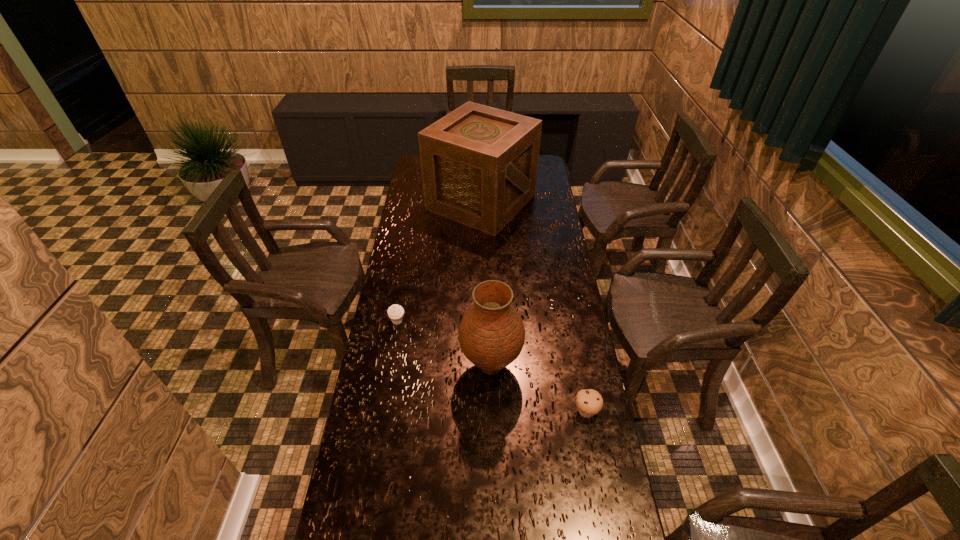
Locate an element on the screen. This screenshot has height=540, width=960. object present at the far edge is located at coordinates (479, 164).

What are the coordinates of `box positioned at the left edge` in the screenshot? It's located at (479, 164).

Where is `muffin that is at the left edge`? This screenshot has height=540, width=960. muffin that is at the left edge is located at coordinates (395, 312).

At what (x,y) coordinates should I click in order to perform the action: click on box at the right edge. Please return your answer as a coordinate pair (x, y). Looking at the image, I should click on (479, 164).

Identify the location of muffin situated at the right edge. This screenshot has width=960, height=540. (589, 402).

Find the location of a particular element. The height and width of the screenshot is (540, 960). object situated at the far left corner is located at coordinates (479, 164).

Find the location of `object that is at the far right corner`. object that is at the far right corner is located at coordinates (479, 164).

This screenshot has width=960, height=540. I want to click on vacant space at the left edge of the desktop, so click(418, 194).

The width and height of the screenshot is (960, 540). I want to click on vacant space at the right edge of the desktop, so click(535, 223).

You are a GUI agent. You are given a task and a screenshot of the screen. Output one action in this format:
    pyautogui.click(x=<x>, y=<y>)
    Task: Click on the free spot at the far right corner of the desktop
    
    Given the screenshot: What is the action you would take?
    pyautogui.click(x=543, y=173)